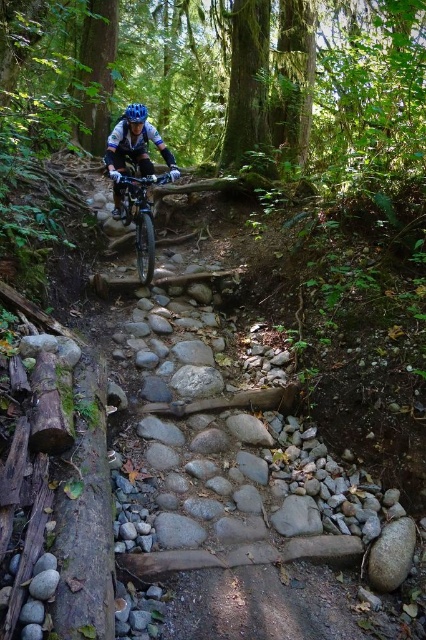
Question: Is shiny metallic bicycle at center thinner than matte blue helmet at center?

Choices:
 (A) yes
 (B) no

Answer: (A)

Question: Estimate the real-world distances between objects in this image. Which object is closer to the matte black helmet at center?

Choices:
 (A) matte blue helmet at center
 (B) shiny metallic bicycle at center

Answer: (B)

Question: Which point appears farthest from the camera in this image?

Choices:
 (A) (123, 132)
 (B) (138, 116)
 (C) (155, 182)

Answer: (A)

Question: Which point is farther to the camera?

Choices:
 (A) (147, 241)
 (B) (140, 120)

Answer: (B)

Question: Does matte black helmet at center appear on the right side of shiny metallic bicycle at center?

Choices:
 (A) yes
 (B) no

Answer: (B)

Question: Can you confirm if matte black helmet at center is thinner than matte blue helmet at center?

Choices:
 (A) no
 (B) yes

Answer: (B)